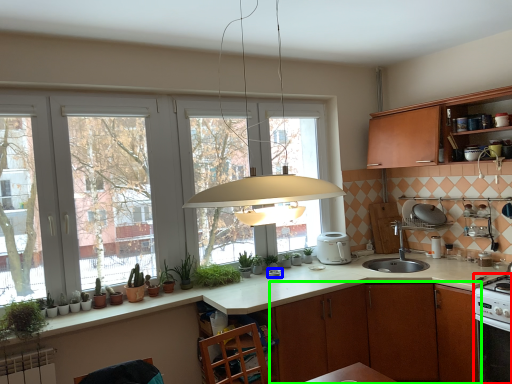
Question: Estimate the real-world distances between objects in this image. Which object is closer to kitchen appliance (highlighted by a red box), appliance (highlighted by a blue box) or cabinetry (highlighted by a green box)?

Choices:
 (A) appliance
 (B) cabinetry

Answer: (B)